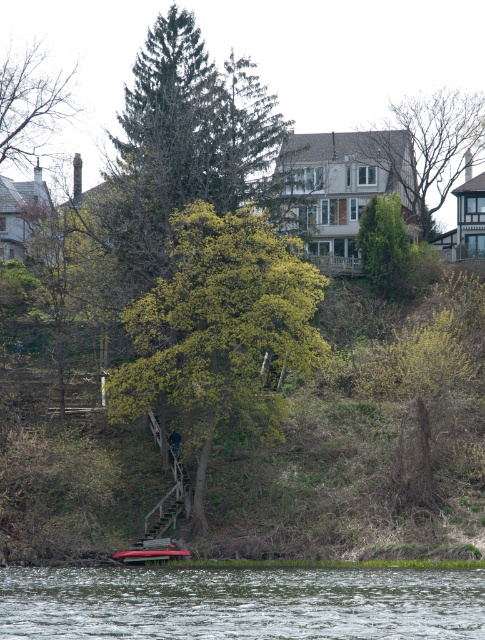
Question: Does green textured evergreen tree at center appear under metallic silver boat at lower center?

Choices:
 (A) yes
 (B) no

Answer: (B)

Question: Does green leafy tree at upper center lie behind metallic silver boat at lower center?

Choices:
 (A) yes
 (B) no

Answer: (A)

Question: Which point is closer to the camera taking this photo?

Choices:
 (A) (400, 288)
 (B) (220, 288)

Answer: (B)

Question: Which point is closer to the camera taking this photo?

Choices:
 (A) (58, 572)
 (B) (404, 227)
 (C) (410, 193)
 (D) (211, 442)

Answer: (A)

Question: Can you confirm if clear water at lower center is positioned below green leafy tree at upper center?

Choices:
 (A) yes
 (B) no

Answer: (A)

Question: Which point is closer to the camera?

Choices:
 (A) green textured evergreen tree at center
 (B) green leafy tree at upper center
 (C) clear water at lower center
 (D) green leafy tree at center

Answer: (C)